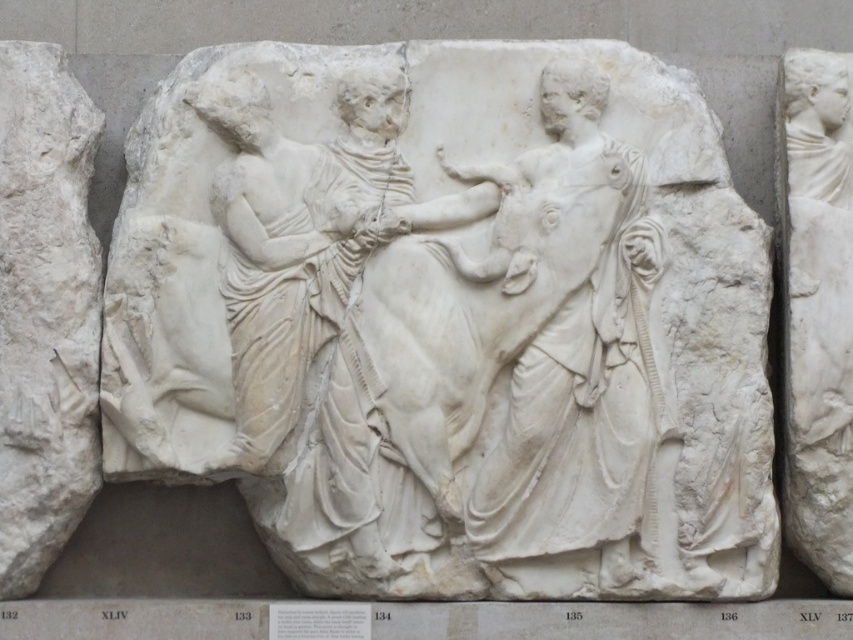
Question: Can you confirm if white marble figure at center is positioned below white marble statue at right?

Choices:
 (A) yes
 (B) no

Answer: (B)

Question: Which of the following is the farthest from the observer?

Choices:
 (A) white marble figure at center
 (B) white marble statue at right

Answer: (B)

Question: Among these points, which one is nearest to the camera?

Choices:
 (A) (335, 492)
 (B) (637, 541)
 (C) (848, 196)

Answer: (A)

Question: Which object is positioned farthest from the white marble statue at right?

Choices:
 (A) white marble figure at center
 (B) white marble relief at center

Answer: (A)

Question: Is white marble relief at center positioned at the back of white marble statue at right?

Choices:
 (A) no
 (B) yes

Answer: (A)

Question: Is white marble figure at center further to the viewer compared to white marble statue at right?

Choices:
 (A) no
 (B) yes

Answer: (A)